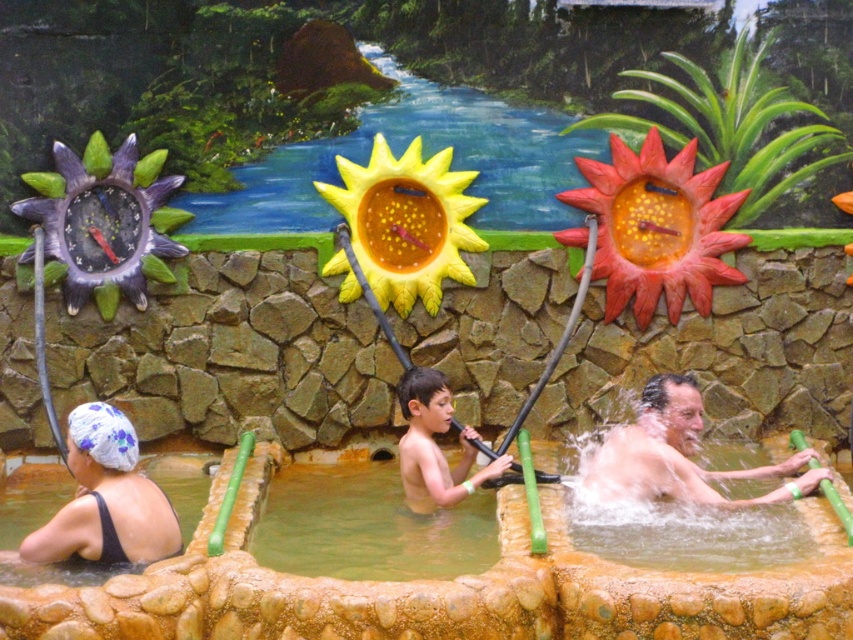
Who is taller, smooth stone hot tub at center or yellow painted sun at upper center?

yellow painted sun at upper center

Measure the distance from smooth stone hot tub at center to yellow painted sun at upper center.

smooth stone hot tub at center is 10.24 meters away from yellow painted sun at upper center.

This screenshot has width=853, height=640. Describe the element at coordinates (442, 589) in the screenshot. I see `smooth stone hot tub at center` at that location.

Identify the location of smooth stone hot tub at center. The height and width of the screenshot is (640, 853). (442, 589).

Who is more distant from viewer, [840,483] or [432,508]?

The point [432,508] is more distant.

Who is positioned more to the right, smooth stone hot tub at center or light brown skin at center?

Positioned to the right is smooth stone hot tub at center.

Who is more forward, (115, 618) or (509, 461)?

Point (115, 618)

The image size is (853, 640). In order to click on smooth stone hot tub at center in this screenshot , I will do `click(442, 589)`.

Does point (70, 428) come behind point (666, 451)?

No, (70, 428) is in front of (666, 451).

Looking at this image, who is positioned more to the left, blue printed fabric at lower left or smooth green pole at lower right?

blue printed fabric at lower left is more to the left.

Between point (44, 545) and point (799, 461), which one is positioned in front?

Point (44, 545) is more forward.

I want to click on blue printed fabric at lower left, so click(103, 500).